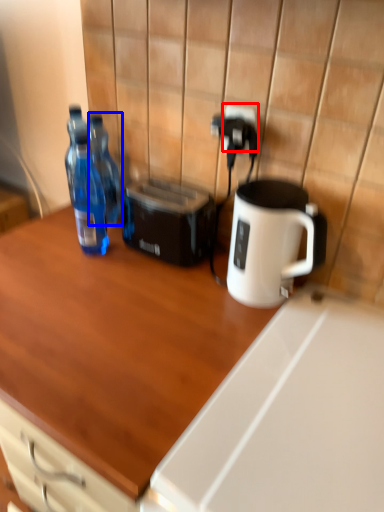
Question: Which object appears farthest to the camera in this image, electric outlet (highlighted by a red box) or bottle (highlighted by a blue box)?

Choices:
 (A) electric outlet
 (B) bottle

Answer: (B)